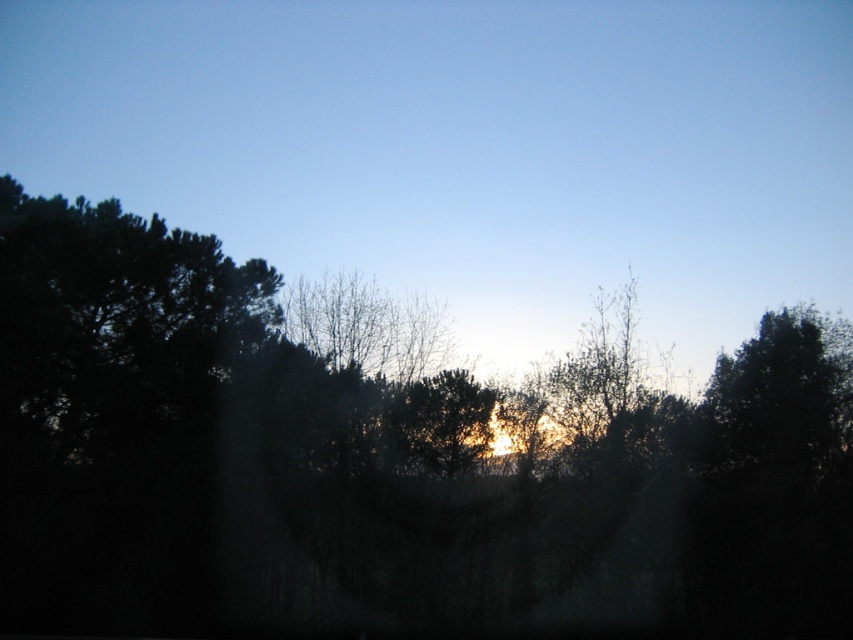
You are standing in a forest and see the dark green leafy tree at center. If you want to take a photo of it from a distance of exactly 15 meters, should you move closer or farther away?

The dark green leafy tree at center is currently 14.23 meters away from you. To achieve a distance of exactly 15 meters, you should move slightly farther away from the dark green leafy tree at center.

You are an observer standing in the forest looking towards the horizon. You notice the dark green leafy tree at center and the golden light at center. Which object is positioned to the right of the other?

The dark green leafy tree at center is positioned to the right of the golden light at center.

You are standing in the forest and see two points marked in the image. Which point, point (534, 609) or point (283, 131), is closer to you?

Point (534, 609) is closer to the camera than point (283, 131).